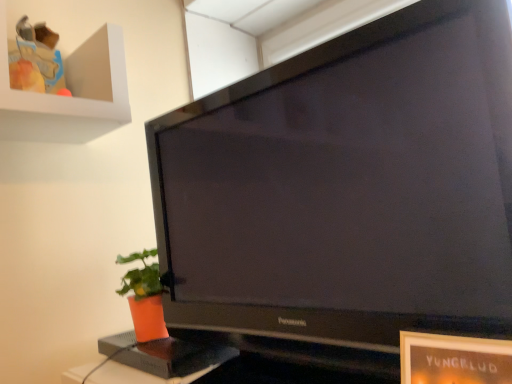
Question: Does black glossy television at center appear on the right side of orange matte pot at lower left?

Choices:
 (A) yes
 (B) no

Answer: (A)

Question: Does black glossy television at center have a smaller size compared to orange matte pot at lower left?

Choices:
 (A) no
 (B) yes

Answer: (A)

Question: Can orange matte pot at lower left be found inside black glossy television at center?

Choices:
 (A) yes
 (B) no

Answer: (B)

Question: From the image's perspective, does black glossy television at center appear higher than orange matte pot at lower left?

Choices:
 (A) yes
 (B) no

Answer: (A)

Question: Can you confirm if black glossy television at center is taller than orange matte pot at lower left?

Choices:
 (A) yes
 (B) no

Answer: (A)

Question: Considering the relative sizes of black glossy television at center and orange matte pot at lower left in the image provided, is black glossy television at center thinner than orange matte pot at lower left?

Choices:
 (A) no
 (B) yes

Answer: (A)

Question: Is orange matte pot at lower left aimed at black glossy television at center?

Choices:
 (A) no
 (B) yes

Answer: (A)

Question: Is orange matte pot at lower left taller than black glossy television at center?

Choices:
 (A) no
 (B) yes

Answer: (A)

Question: Is orange matte pot at lower left facing away from black glossy television at center?

Choices:
 (A) yes
 (B) no

Answer: (B)

Question: Is orange matte pot at lower left at the right side of black glossy television at center?

Choices:
 (A) yes
 (B) no

Answer: (B)

Question: Is orange matte pot at lower left touching black glossy television at center?

Choices:
 (A) yes
 (B) no

Answer: (B)

Question: Is orange matte pot at lower left thinner than black glossy television at center?

Choices:
 (A) no
 (B) yes

Answer: (B)

Question: From a real-world perspective, is black glossy television at center above or below orange matte pot at lower left?

Choices:
 (A) above
 (B) below

Answer: (A)